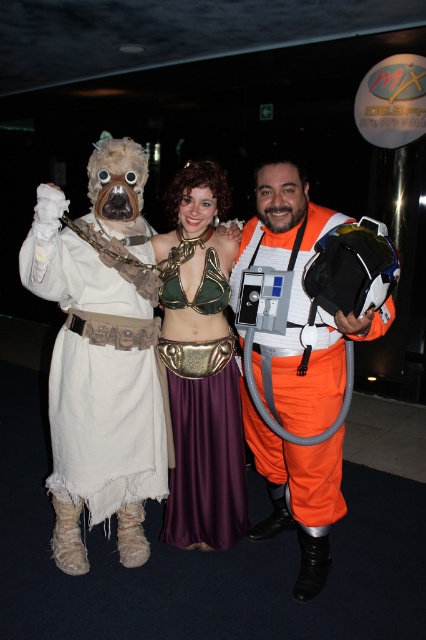
You are standing in the convention hall and see the orange fabric spacesuit at center and the velvet purple skirt at center. Which object is positioned lower in the image?

The orange fabric spacesuit at center is positioned below the velvet purple skirt at center, so it is lower in the image.